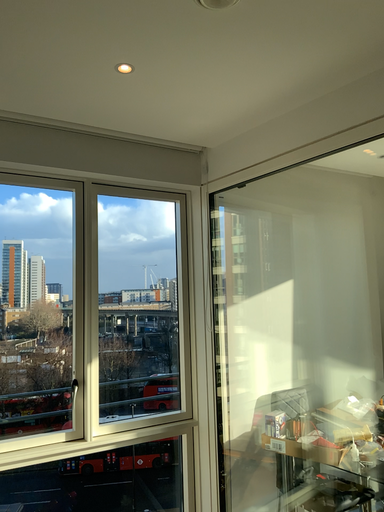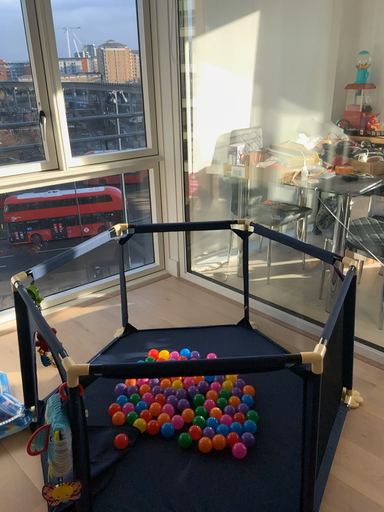
Question: How did the camera likely rotate when shooting the video?

Choices:
 (A) rotated right
 (B) rotated left

Answer: (A)